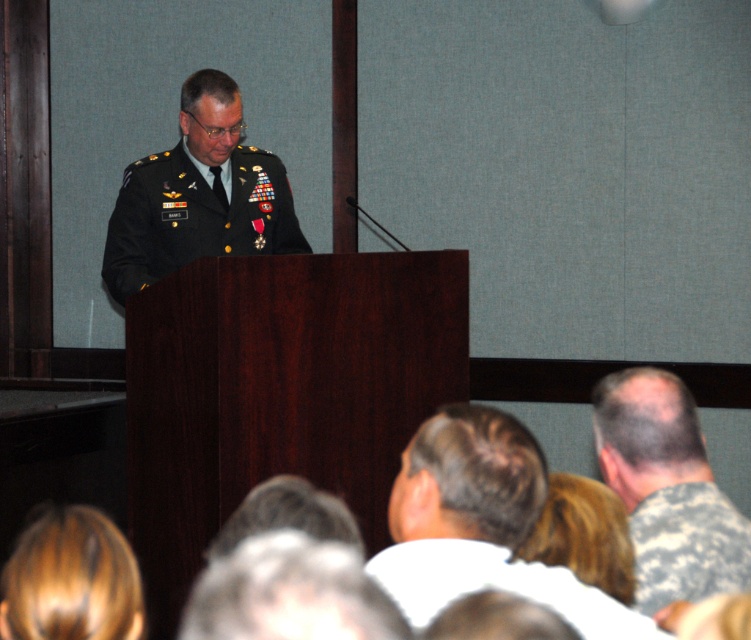
You are attending a military ceremony and see two individuals in the scene described. The first is wearing a green military uniform at center, and the second is in a camouflage uniform at lower right. Based on their positions in the image, which one is standing closer to the front of the stage?

The camouflage uniform at lower right is closer to the front of the stage because objects positioned lower in the image are typically closer to the viewer.

You are standing at the point with coordinates point (59, 632) and want to walk to the point with coordinates point (721, 545). Which direction should you move in?

You should move backward because point (721, 545) is behind point (59, 632).